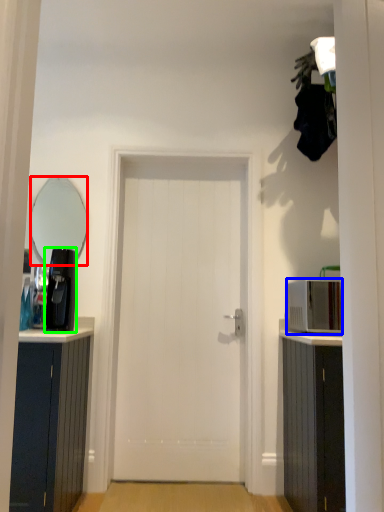
Question: Which object is the closest to the mirror (highlighted by a red box)? Choose among these: appliance (highlighted by a blue box) or coffee machine (highlighted by a green box).

Choices:
 (A) appliance
 (B) coffee machine

Answer: (B)